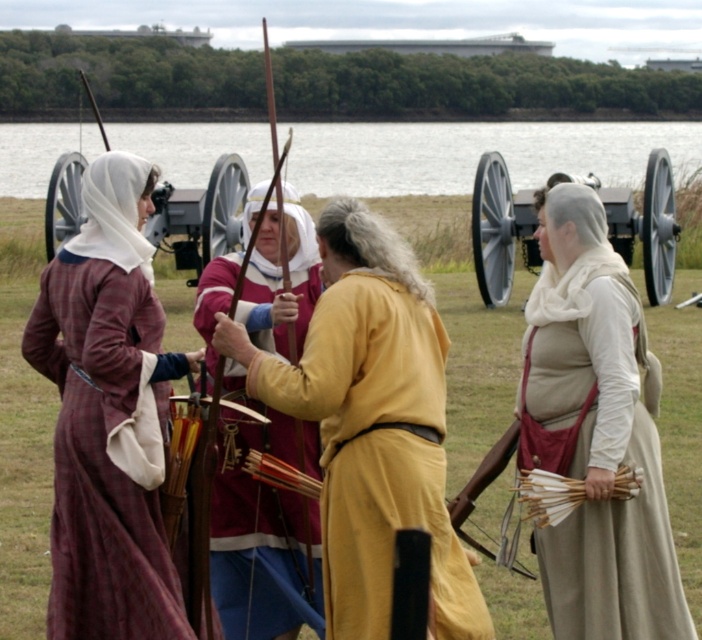
Question: Does golden-yellow fabric at center have a larger size compared to maroon velvet tunic at center?

Choices:
 (A) yes
 (B) no

Answer: (B)

Question: Which point appears closest to the camera in this image?

Choices:
 (A) (625, 241)
 (B) (58, 378)

Answer: (B)

Question: Considering the real-world distances, which object is closest to the plaid wool dress at left?

Choices:
 (A) polished brass cannon at center
 (B) beige woolen vest at right

Answer: (B)

Question: In this image, where is golden-yellow fabric at center located relative to maroon velvet tunic at center?

Choices:
 (A) right
 (B) left

Answer: (A)

Question: Estimate the real-world distances between objects in this image. Which object is farther from the golden-yellow fabric at center?

Choices:
 (A) gray metallic cannon at center
 (B) maroon velvet tunic at center
 (C) polished brass cannon at center
 (D) beige woolen vest at right

Answer: (A)

Question: Can you confirm if plaid wool dress at left is wider than gray metallic cannon at center?

Choices:
 (A) yes
 (B) no

Answer: (A)